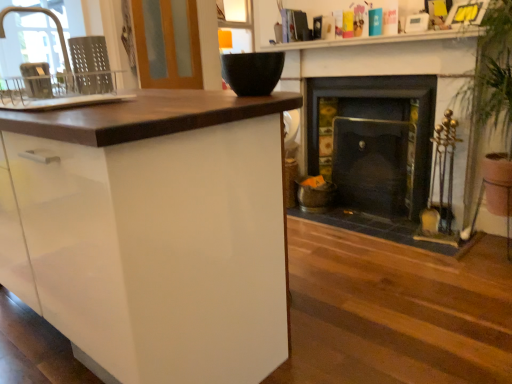
Question: Can you see dark gray stone fireplace at right, the first fireplace in the left-to-right sequence, touching matte black bowl at upper center?

Choices:
 (A) yes
 (B) no

Answer: (B)

Question: Does dark gray stone fireplace at right, the first fireplace in the left-to-right sequence, have a smaller size compared to matte black bowl at upper center?

Choices:
 (A) yes
 (B) no

Answer: (B)

Question: Is dark gray stone fireplace at right, the first fireplace in the left-to-right sequence, in front of matte black bowl at upper center?

Choices:
 (A) yes
 (B) no

Answer: (B)

Question: Is dark gray stone fireplace at right, placed as the 2th fireplace when sorted from right to left, looking in the opposite direction of matte black bowl at upper center?

Choices:
 (A) no
 (B) yes

Answer: (A)

Question: From the image's perspective, is dark gray stone fireplace at right, the first fireplace in the left-to-right sequence, beneath matte black bowl at upper center?

Choices:
 (A) no
 (B) yes

Answer: (B)

Question: From the image's perspective, relative to dark brown wood fireplace at center, which is counted as the 2th fireplace, starting from the left, is dark gray stone fireplace at right, the first fireplace in the left-to-right sequence, above or below?

Choices:
 (A) below
 (B) above

Answer: (B)

Question: Do you think dark gray stone fireplace at right, the first fireplace in the left-to-right sequence, is within dark brown wood fireplace at center, which ranks as the first fireplace in right-to-left order, or outside of it?

Choices:
 (A) outside
 (B) inside

Answer: (B)

Question: Would you say dark gray stone fireplace at right, the first fireplace in the left-to-right sequence, is to the left or to the right of dark brown wood fireplace at center, which ranks as the first fireplace in right-to-left order, in the picture?

Choices:
 (A) left
 (B) right

Answer: (A)

Question: From a real-world perspective, is dark gray stone fireplace at right, placed as the 2th fireplace when sorted from right to left, above or below dark brown wood fireplace at center, which is counted as the 2th fireplace, starting from the left?

Choices:
 (A) above
 (B) below

Answer: (A)

Question: From a real-world perspective, relative to wooden screen door at upper left, is white glossy cabinet at left vertically above or below?

Choices:
 (A) above
 (B) below

Answer: (B)

Question: Considering their positions, is white glossy cabinet at left located in front of or behind wooden screen door at upper left?

Choices:
 (A) front
 (B) behind

Answer: (A)

Question: Looking at their shapes, would you say white glossy cabinet at left is wider or thinner than wooden screen door at upper left?

Choices:
 (A) wide
 (B) thin

Answer: (A)

Question: Is point (92, 198) positioned closer to the camera than point (140, 29)?

Choices:
 (A) farther
 (B) closer

Answer: (B)

Question: From the image's perspective, is metallic gray dish rack at left, the second appliance positioned from the right, above or below black matte bowl at upper center, the first appliance in the right-to-left sequence?

Choices:
 (A) below
 (B) above

Answer: (A)

Question: Considering the positions of metallic gray dish rack at left, the 1th appliance from the left, and black matte bowl at upper center, which is the 2th appliance from left to right, in the image, is metallic gray dish rack at left, the 1th appliance from the left, bigger or smaller than black matte bowl at upper center, which is the 2th appliance from left to right,?

Choices:
 (A) big
 (B) small

Answer: (B)